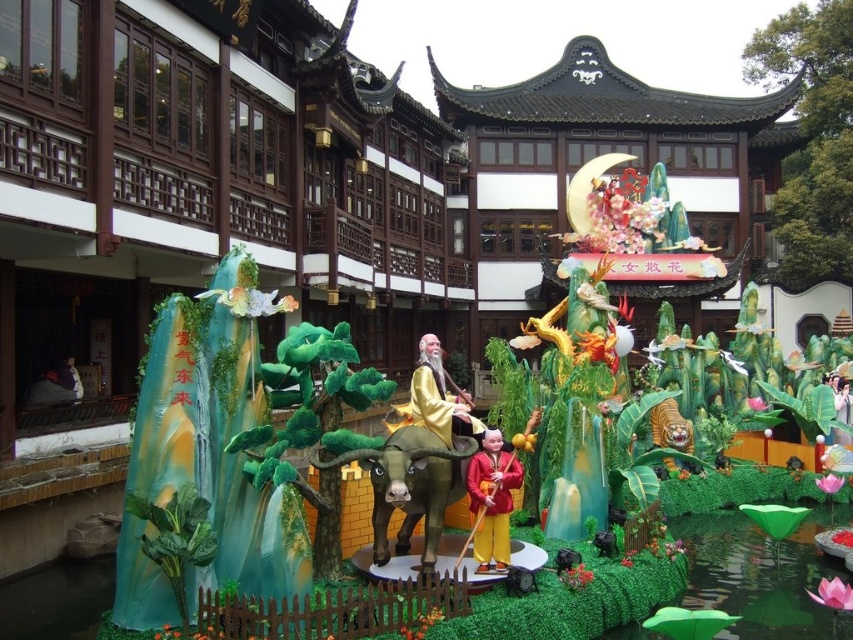
Question: Is green matte ox at center bigger than gold shiny robe at center?

Choices:
 (A) no
 (B) yes

Answer: (A)

Question: Estimate the real-world distances between objects in this image. Which object is farther from the smooth red fabric at center?

Choices:
 (A) green matte ox at center
 (B) gold shiny robe at center

Answer: (B)

Question: Does green matte ox at center appear on the left side of gold shiny robe at center?

Choices:
 (A) yes
 (B) no

Answer: (A)

Question: Which of the following is the closest to the observer?

Choices:
 (A) gold shiny robe at center
 (B) green matte ox at center

Answer: (B)

Question: Which of the following is the farthest from the observer?

Choices:
 (A) (433, 408)
 (B) (410, 472)
 (C) (479, 556)

Answer: (A)

Question: Is green matte ox at center positioned before gold shiny robe at center?

Choices:
 (A) yes
 (B) no

Answer: (A)